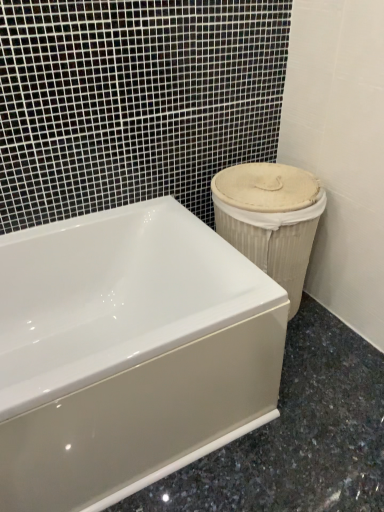
The height and width of the screenshot is (512, 384). In order to click on free location in front of beige woven basket at right in this screenshot , I will do [x=313, y=369].